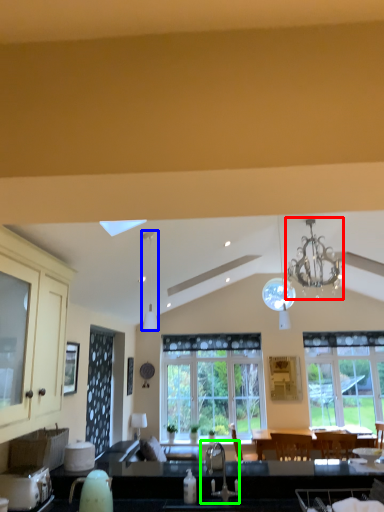
Question: Which is farther away from light fixture (highlighted by a red box)? light fixture (highlighted by a blue box) or sink (highlighted by a green box)?

Choices:
 (A) light fixture
 (B) sink

Answer: (A)